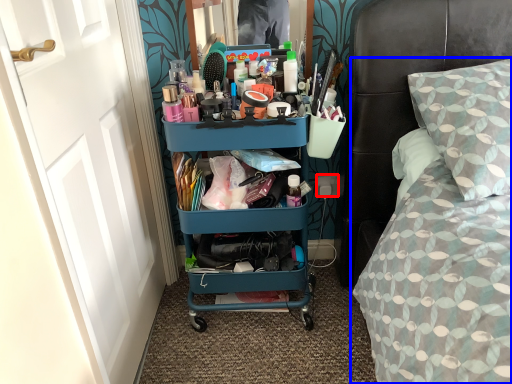
Question: Which object appears farthest to the camera in this image, power outlet (highlighted by a red box) or bed (highlighted by a blue box)?

Choices:
 (A) power outlet
 (B) bed

Answer: (A)